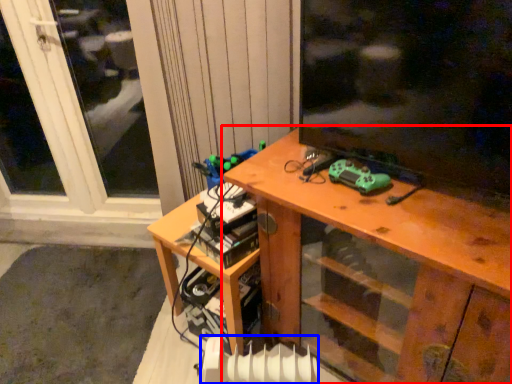
Question: Among these objects, which one is nearest to the camera, desk (highlighted by a red box) or radiator (highlighted by a blue box)?

Choices:
 (A) desk
 (B) radiator

Answer: (A)